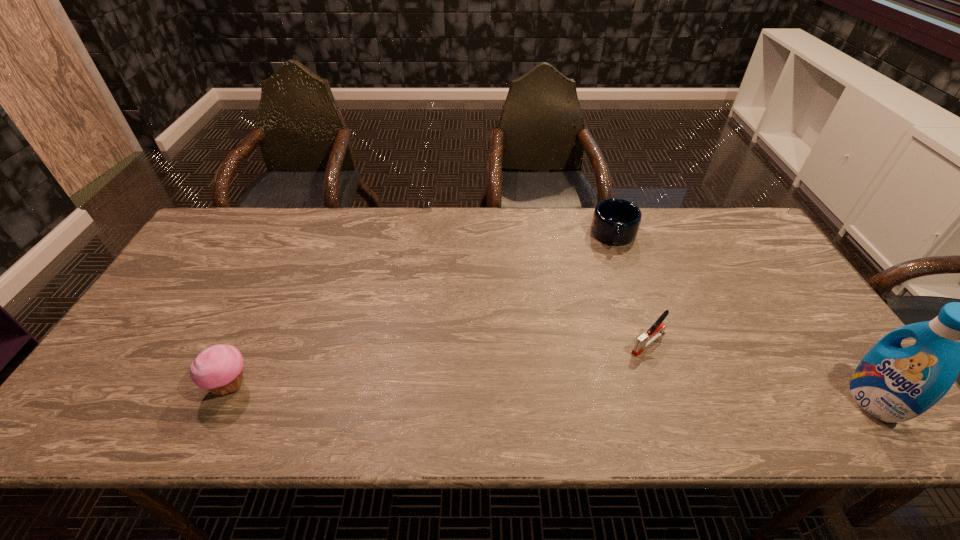
Image resolution: width=960 pixels, height=540 pixels. I want to click on vacant space situated 0.170m on the handle side of the third nearest object, so click(588, 388).

Where is `free location located 0.150m on the handle side of the third nearest object`? The height and width of the screenshot is (540, 960). free location located 0.150m on the handle side of the third nearest object is located at coordinates (594, 383).

This screenshot has height=540, width=960. I want to click on free space located 0.070m on the handle side of the third nearest object, so click(x=617, y=366).

The width and height of the screenshot is (960, 540). Identify the location of object that is at the far edge. (615, 221).

The image size is (960, 540). What are the coordinates of `cupcake present at the near edge` in the screenshot? It's located at (218, 368).

Find the location of a particular element. detergent that is at the near edge is located at coordinates (894, 384).

At what (x,y) coordinates should I click in order to perform the action: click on object situated at the right edge. Please return your answer as a coordinate pair (x, y). The image size is (960, 540). Looking at the image, I should click on pos(894,384).

Where is `object that is positioned at the near right corner`? The width and height of the screenshot is (960, 540). object that is positioned at the near right corner is located at coordinates (894, 384).

The height and width of the screenshot is (540, 960). Find the location of `vacant area at the far edge`. vacant area at the far edge is located at coordinates (432, 231).

The height and width of the screenshot is (540, 960). What are the coordinates of `blank space at the near edge` in the screenshot? It's located at (663, 384).